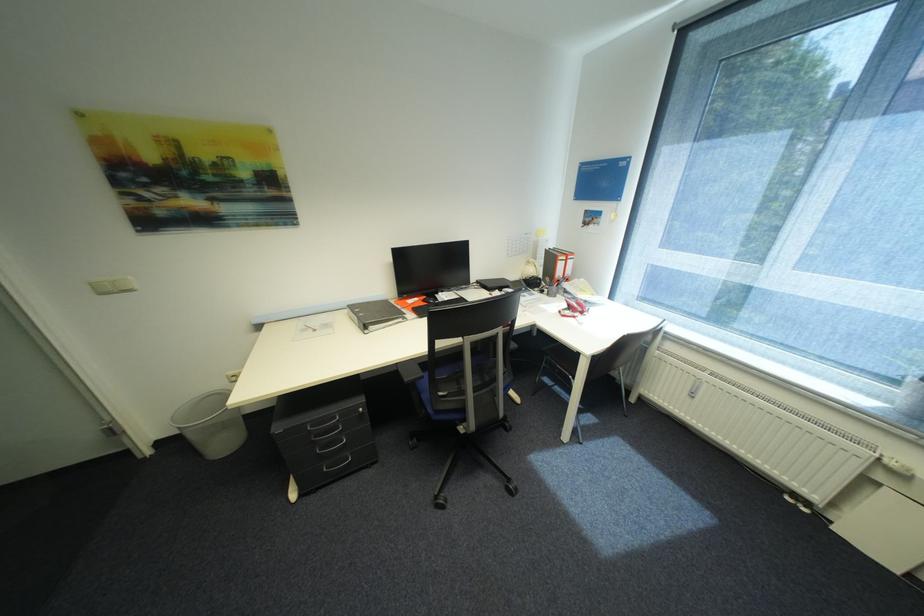
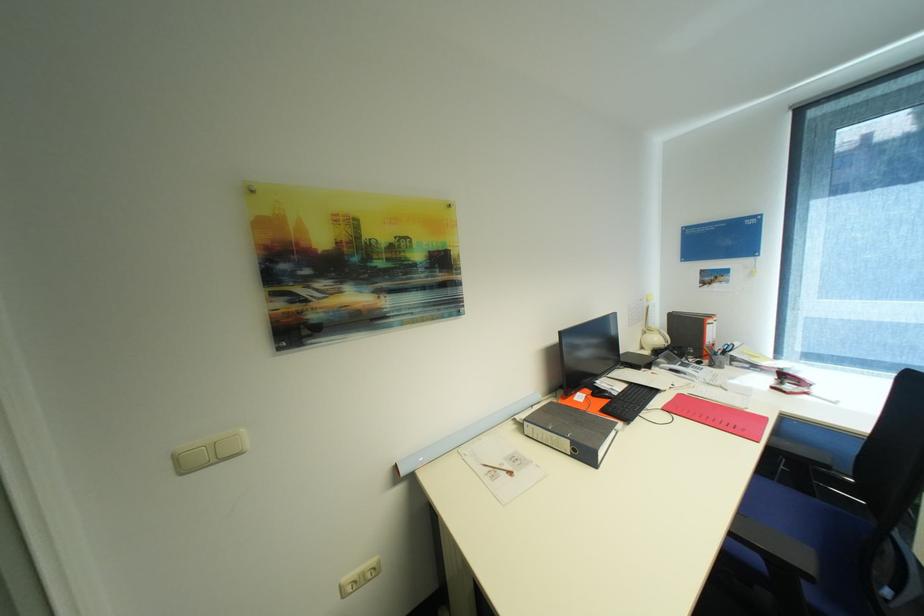
The point at (x=540, y=270) is marked in the first image. Where is the corresponding point in the second image?

(663, 339)